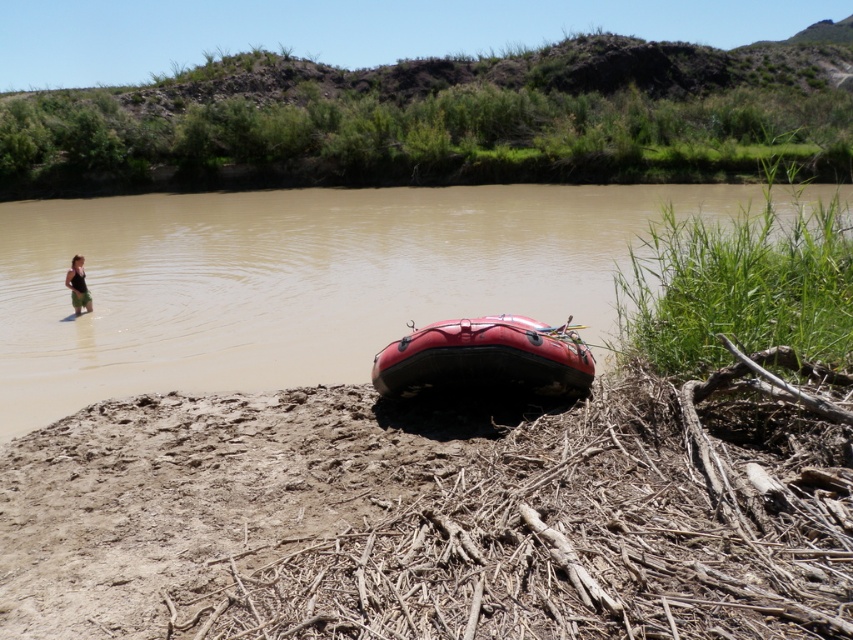
Question: Which is nearer to the matte black swimsuit at left?

Choices:
 (A) brown muddy water at lower center
 (B) rubber boat at lower center

Answer: (B)

Question: Among these objects, which one is nearest to the camera?

Choices:
 (A) matte black swimsuit at left
 (B) brown muddy water at lower center

Answer: (B)

Question: Which object appears closest to the camera in this image?

Choices:
 (A) brown muddy water at lower center
 (B) matte black swimsuit at left
 (C) rubber boat at lower center

Answer: (C)

Question: Is brown muddy water at lower center closer to the viewer compared to rubber boat at lower center?

Choices:
 (A) yes
 (B) no

Answer: (B)

Question: Is brown muddy water at lower center closer to the viewer compared to rubber boat at lower center?

Choices:
 (A) yes
 (B) no

Answer: (B)

Question: Is brown muddy water at lower center positioned before matte black swimsuit at left?

Choices:
 (A) yes
 (B) no

Answer: (A)